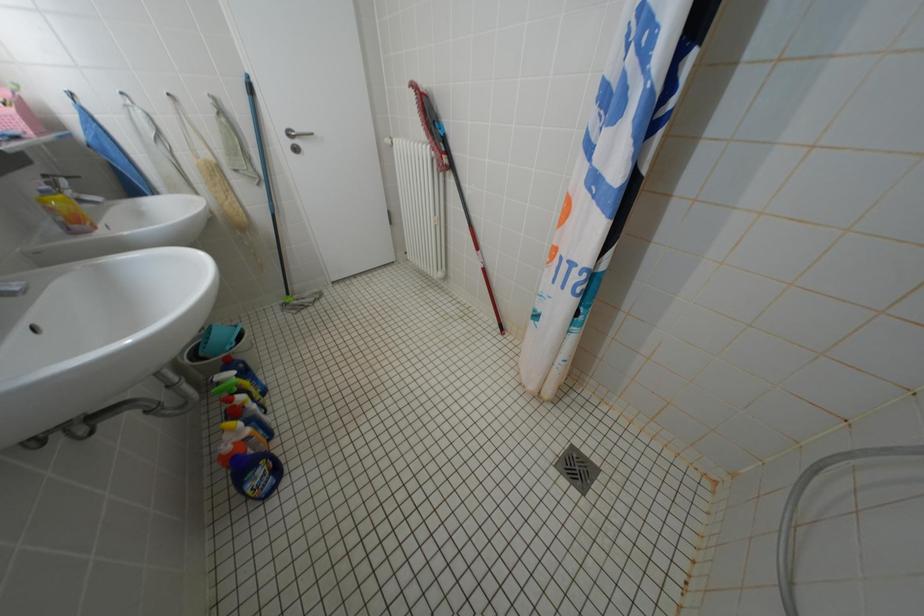
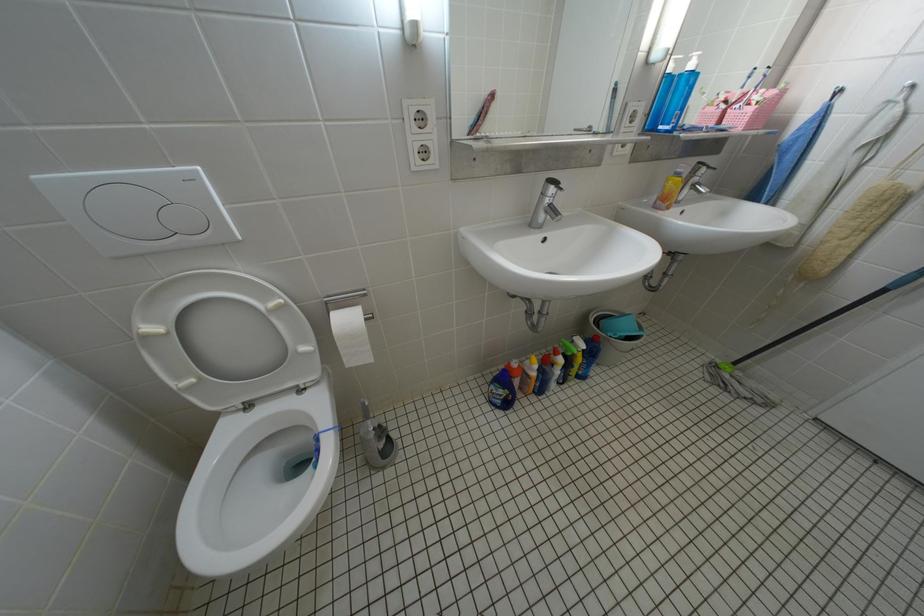
The images are taken continuously from a first-person perspective. In which direction is your viewpoint rotating?

The rotation direction of the camera is left-down.